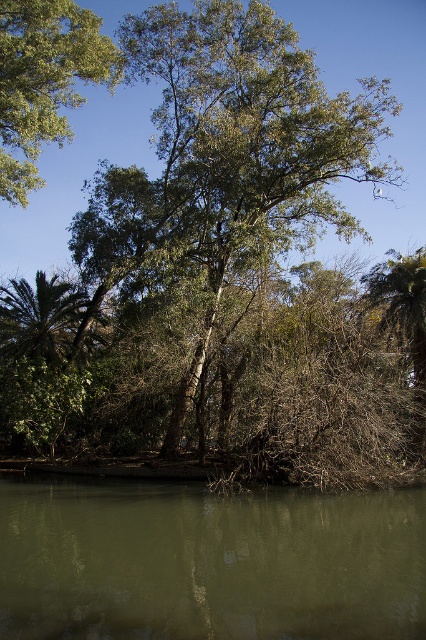
Between green leafy tree at center and green leafy tree at upper left, which one has more height?

green leafy tree at center is taller.

Does green leafy tree at center have a lesser width compared to green leafy tree at upper left?

In fact, green leafy tree at center might be wider than green leafy tree at upper left.

Image resolution: width=426 pixels, height=640 pixels. What are the coordinates of `green leafy tree at center` in the screenshot? It's located at (221, 173).

From the picture: Does green murky water at lower center appear on the left side of green leafy tree at upper left?

In fact, green murky water at lower center is to the right of green leafy tree at upper left.

This screenshot has height=640, width=426. What do you see at coordinates (209, 563) in the screenshot? I see `green murky water at lower center` at bounding box center [209, 563].

Locate an element on the screen. The image size is (426, 640). green murky water at lower center is located at coordinates (209, 563).

Can you confirm if green leafy tree at upper left is smaller than green leafy palm tree at left?

No.

Does point (89, 28) come in front of point (20, 284)?

That is True.

Find the location of a particular element. This screenshot has width=426, height=640. green leafy tree at upper left is located at coordinates point(43,81).